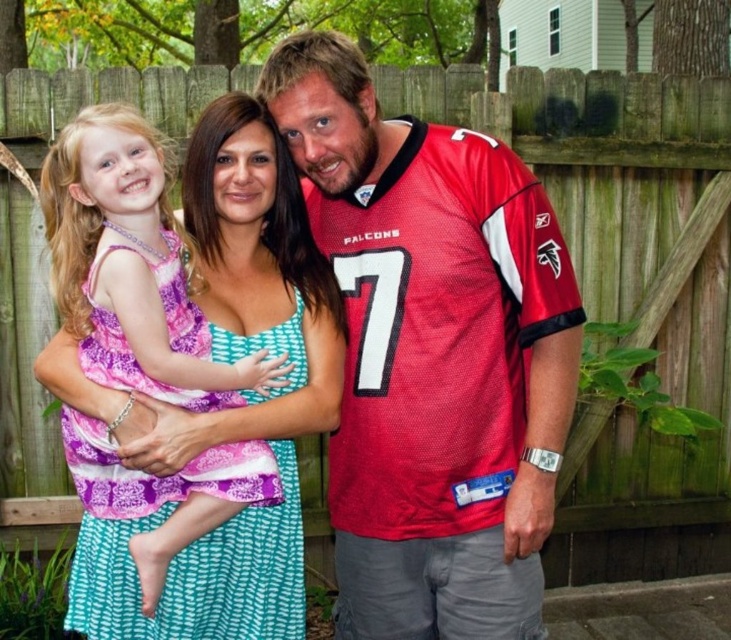
You are a photographer trying to capture a clear shot of both the red jersey at center and the purple printed fabric dress at center. Based on their heights, which one should you focus on first to ensure both are in frame?

The red jersey at center is taller than the purple printed fabric dress at center, so you should focus on the red jersey at center first to ensure both are in frame.

You are a photographer trying to capture a candid shot of the two central figures. Since you want to ensure the red jersey at center and the purple printed fabric dress at center are both in focus, which one should you position your camera focus closer to?

You should focus closer to the purple printed fabric dress at center because the red jersey at center is to the right of it, meaning the dress is closer to the camera.